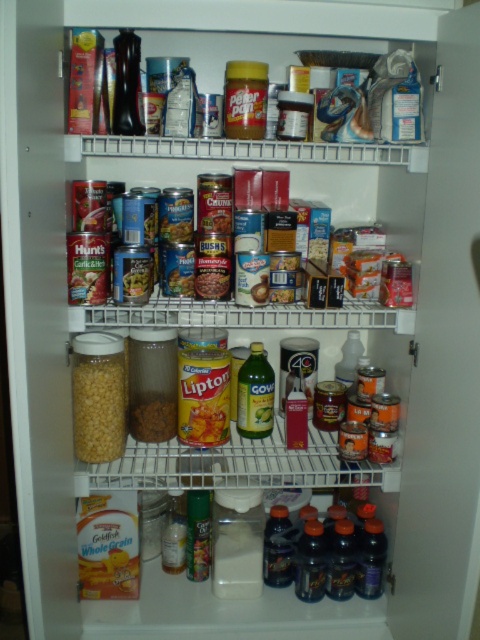
Question: Which point appears farthest from the camera in this image?

Choices:
 (A) (135, 266)
 (B) (201, 442)
 (C) (165, 435)
 (D) (73, 387)

Answer: (C)

Question: Is yellow matte corn at center above green matte can at center?

Choices:
 (A) no
 (B) yes

Answer: (A)

Question: Among these objects, which one is farthest from the camera?

Choices:
 (A) green matte can at center
 (B) yellow matte corn at center
 (C) brown crunchy cereal at center
 (D) yellow matte lipton tea at center

Answer: (C)

Question: Can you confirm if yellow matte lipton tea at center is wider than brown crunchy cereal at center?

Choices:
 (A) yes
 (B) no

Answer: (A)

Question: Which of the following is the closest to the observer?

Choices:
 (A) green matte can at center
 (B) brown crunchy cereal at center
 (C) yellow matte lipton tea at center
 (D) yellow matte corn at center

Answer: (A)

Question: Is yellow matte corn at center below green matte can at center?

Choices:
 (A) yes
 (B) no

Answer: (A)